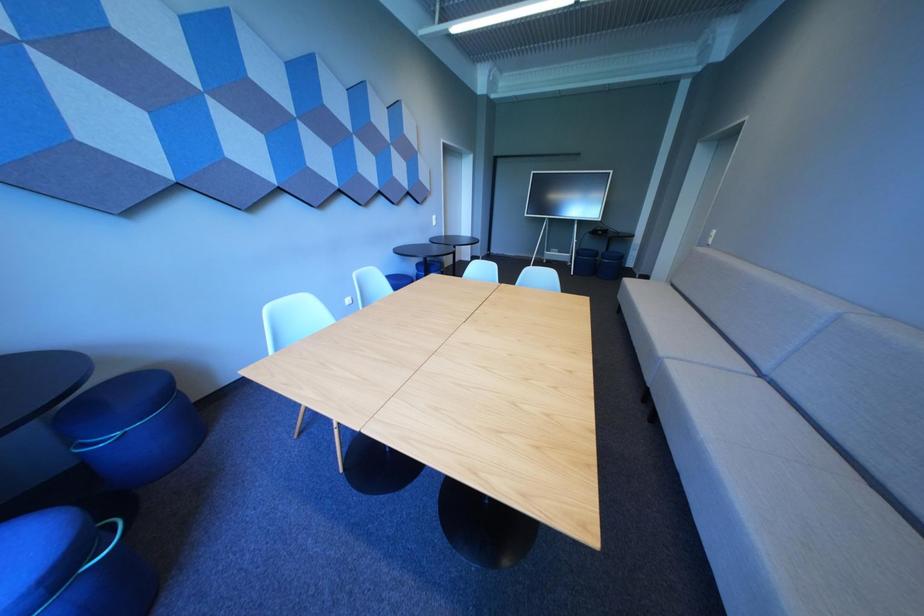
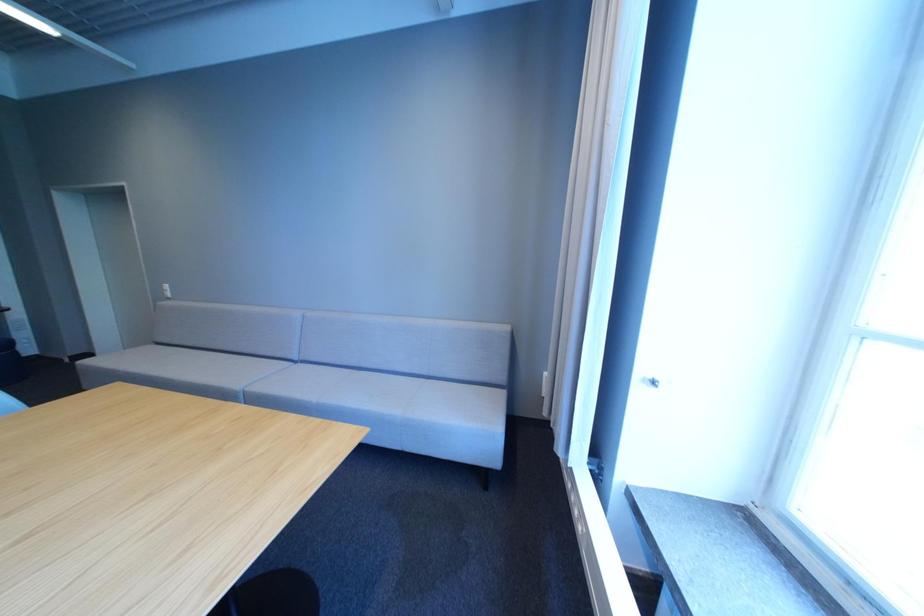
How did the camera likely rotate?

The camera rotated toward right-down.